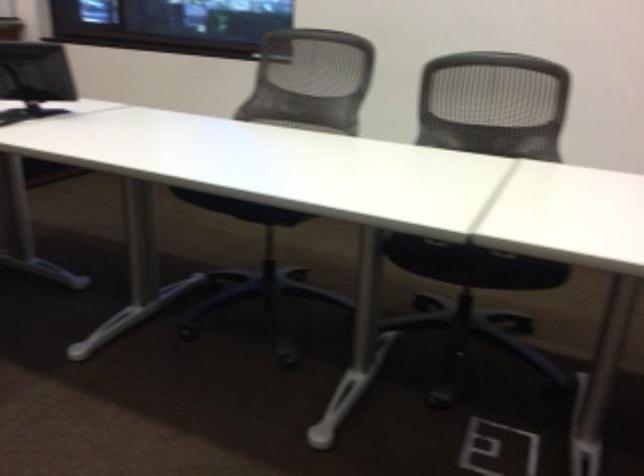
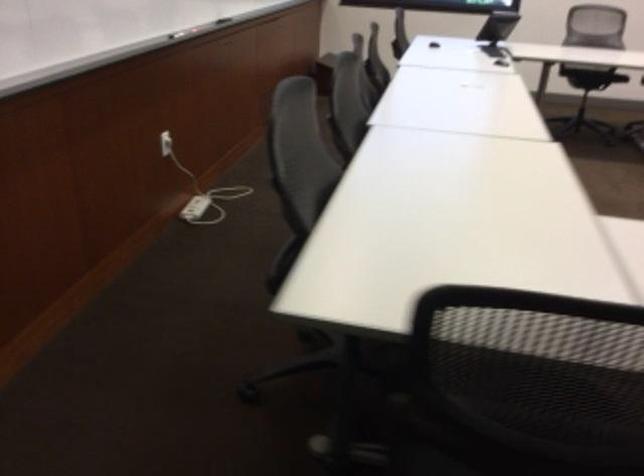
The images are taken continuously from a first-person perspective. In which direction are you moving?

The cameraman moved toward left, backward.